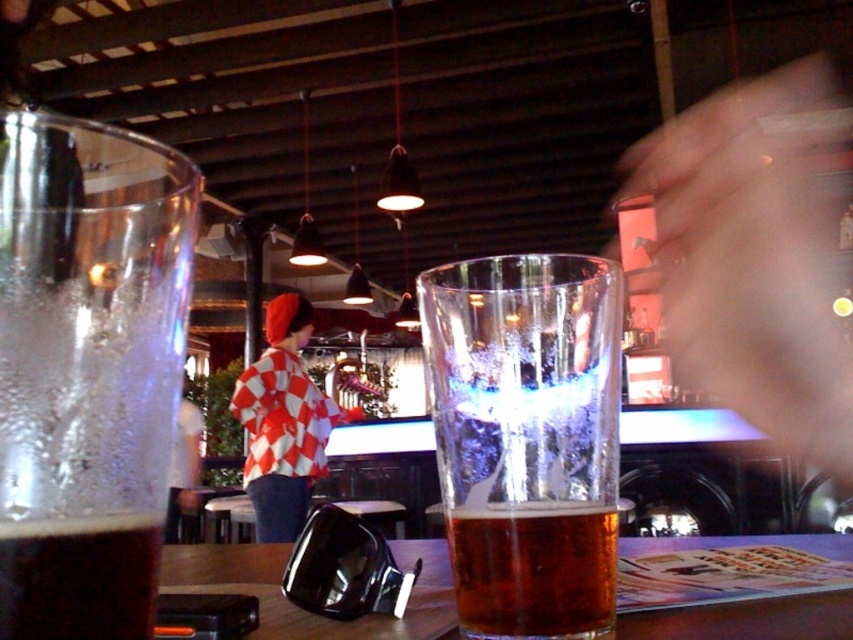
You are a customer at the bar and want to place your order with the bartender. You notice the wooden table at center and the red checkered shirt at center. Which object is smaller in size?

The wooden table at center is smaller in size compared to the red checkered shirt at center according to the description.

You are at a bar and want to place your phone on the wooden table at center. The phone is 15 cm long. Can the translucent glass beer at left on the table accommodate the phone without falling off?

The translucent glass beer at left is smaller than the wooden table at center, so the phone can be placed on the wooden table at center without any issue as the table is larger than the glass.